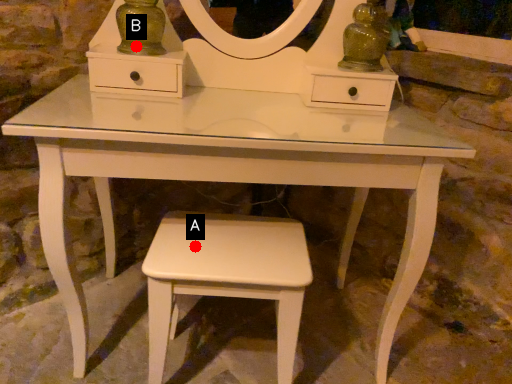
Question: Two points are circled on the image, labeled by A and B beside each circle. Which point is closer to the camera taking this photo?

Choices:
 (A) A is closer
 (B) B is closer

Answer: (A)